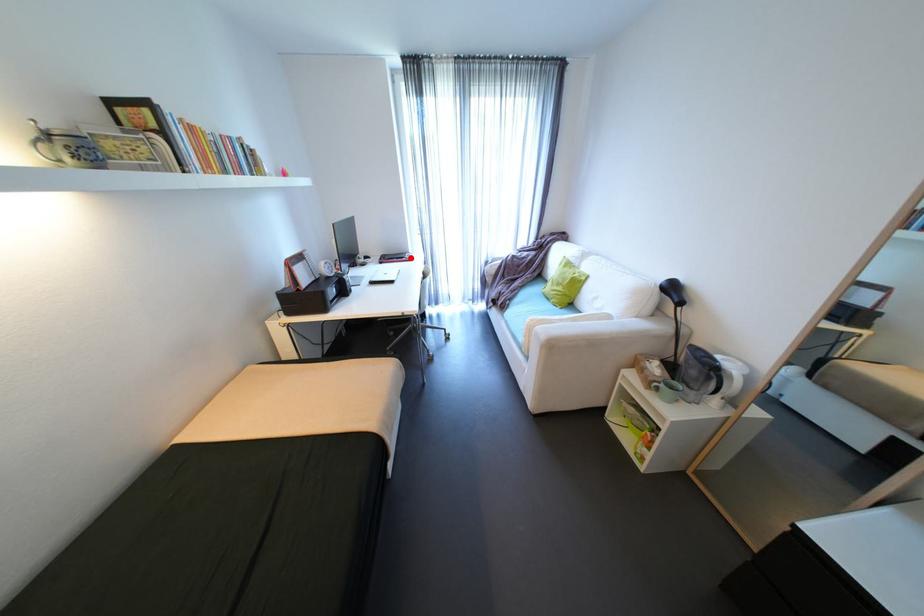
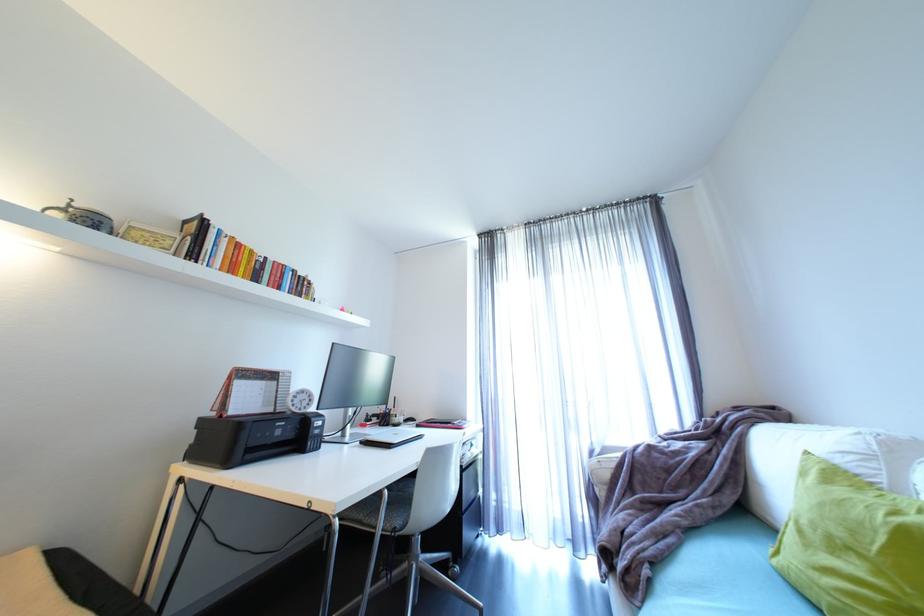
Locate, in the second image, the point that corresponds to the highlighted location in the first image.

(457, 424)